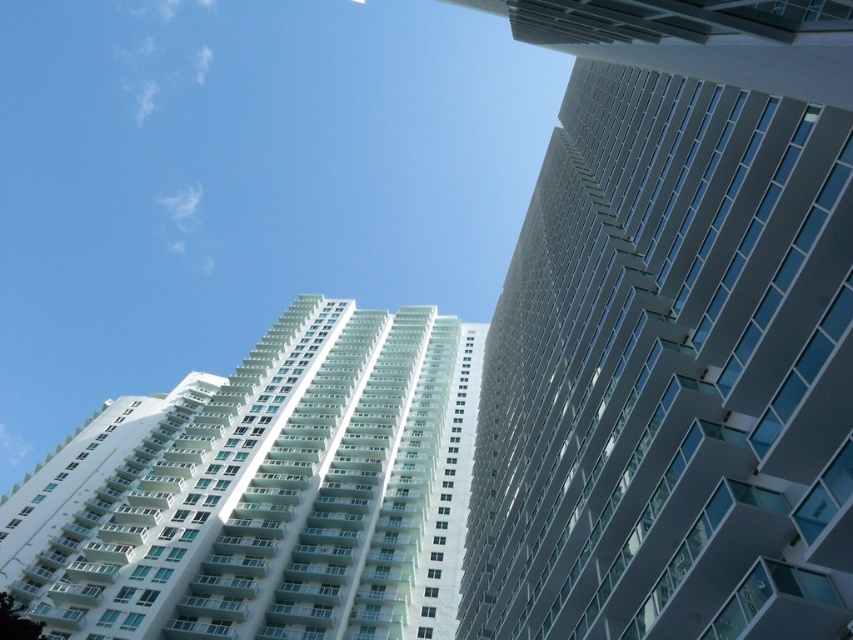
Question: Considering the relative positions of smooth glass building at right and white glossy building at center in the image provided, where is smooth glass building at right located with respect to white glossy building at center?

Choices:
 (A) right
 (B) left

Answer: (A)

Question: Can you confirm if smooth glass building at right is bigger than white glossy building at center?

Choices:
 (A) no
 (B) yes

Answer: (A)

Question: Among these points, which one is nearest to the camera?

Choices:
 (A) (x=372, y=586)
 (B) (x=746, y=531)

Answer: (B)

Question: Is smooth glass building at right in front of white glossy building at center?

Choices:
 (A) no
 (B) yes

Answer: (B)